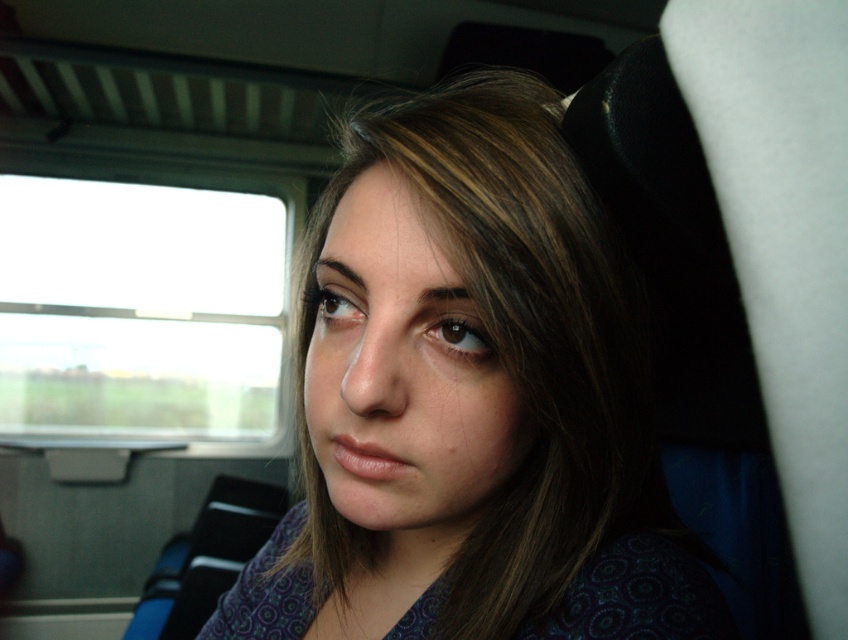
Question: Is matte purple shirt at center below transparent glass window at left?

Choices:
 (A) yes
 (B) no

Answer: (A)

Question: Does matte purple shirt at center have a smaller size compared to transparent glass window at left?

Choices:
 (A) no
 (B) yes

Answer: (B)

Question: Which object is farther from the camera taking this photo?

Choices:
 (A) matte purple shirt at center
 (B) transparent glass window at left

Answer: (B)

Question: Can you confirm if matte purple shirt at center is smaller than transparent glass window at left?

Choices:
 (A) no
 (B) yes

Answer: (B)